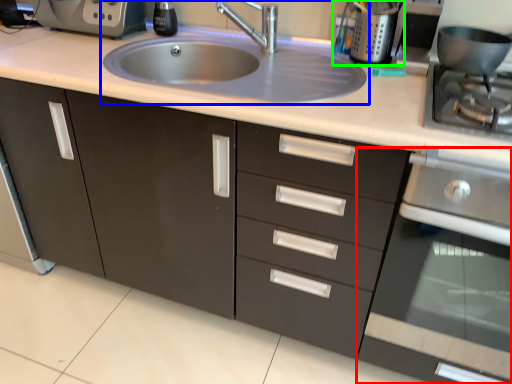
Question: Based on their relative distances, which object is nearer to oven (highlighted by a red box)? Choose from sink (highlighted by a blue box) and appliance (highlighted by a green box).

Choices:
 (A) sink
 (B) appliance

Answer: (A)